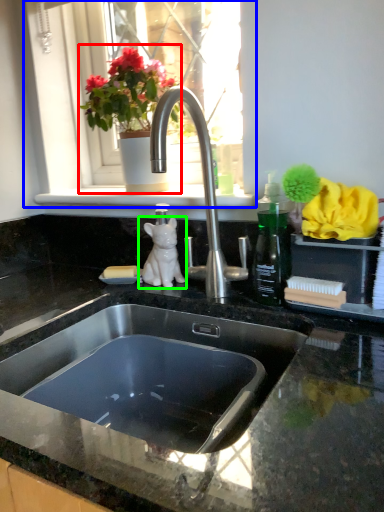
Question: Which object is positioned closest to houseplant (highlighted by a red box)? Select from window (highlighted by a blue box) and animal (highlighted by a green box).

Choices:
 (A) window
 (B) animal

Answer: (A)